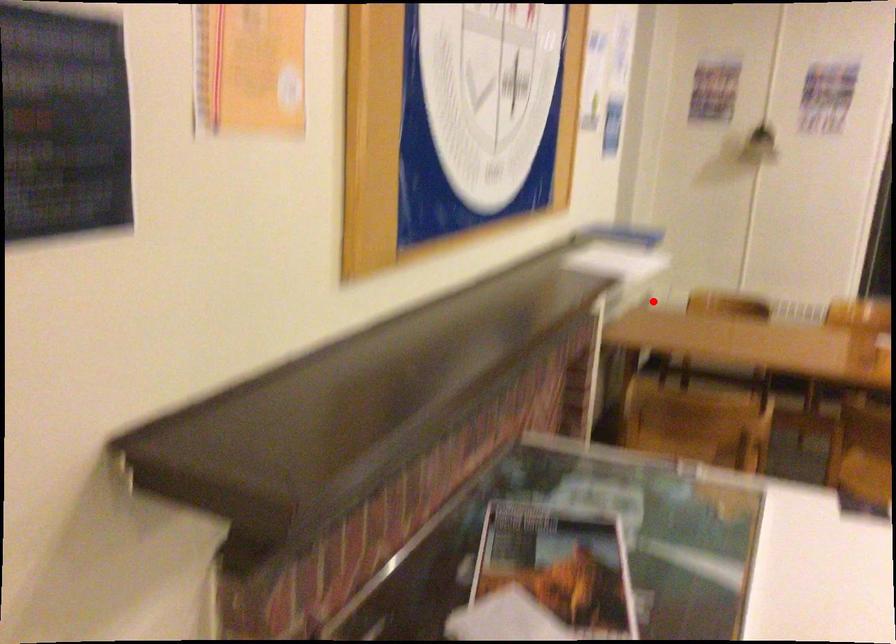
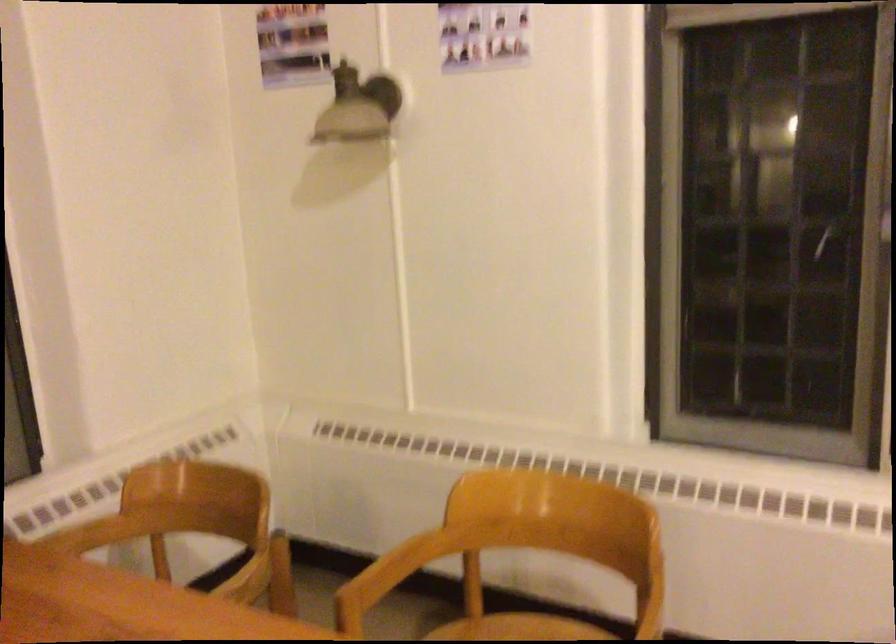
Question: A red point is marked in image1. In image2, is the corresponding 3D point closer to the camera or farther? Reply with the corresponding letter.

Choices:
 (A) The corresponding 3D point is closer.
 (B) The corresponding 3D point is farther.

Answer: (A)